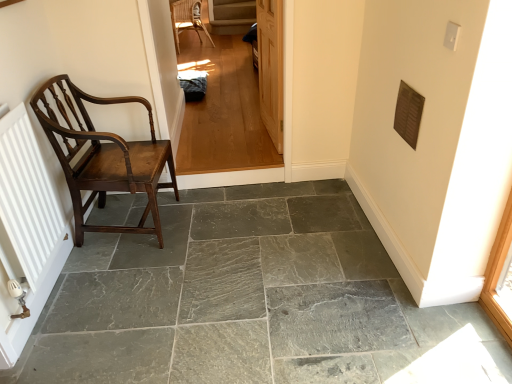
This screenshot has width=512, height=384. Describe the element at coordinates (187, 20) in the screenshot. I see `woven wicker chair at upper center, which is the 2th chair from front to back` at that location.

Locate an element on the screen. gray stone floor at center is located at coordinates (228, 295).

What is the approximate width of light brown wood floor at center?

4.91 inches.

I want to click on woven wicker chair at upper center, which is the 2th chair from front to back, so (x=187, y=20).

From a real-world perspective, who is located higher, gray stone floor at center or light brown wood floor at center?

light brown wood floor at center.

Is gray stone floor at center taller or shorter than light brown wood floor at center?

In the image, gray stone floor at center appears to be shorter than light brown wood floor at center.

Considering the relative positions of gray stone floor at center and light brown wood floor at center in the image provided, is gray stone floor at center to the left of light brown wood floor at center from the viewer's perspective?

In fact, gray stone floor at center is to the right of light brown wood floor at center.

In the scene shown: From the image's perspective, does gray stone floor at center appear higher than light brown wood floor at center?

No, from the image's perspective, gray stone floor at center is not above light brown wood floor at center.

From a real-world perspective, which is physically below, light brown wood floor at center or gray stone floor at center?

gray stone floor at center, from a real-world perspective.

This screenshot has height=384, width=512. I want to click on concrete below the light brown wood floor at center (from a real-world perspective), so pyautogui.click(x=228, y=295).

Which is less distant, [221,40] or [125,351]?

Point [221,40] is positioned farther from the camera compared to point [125,351].

Considering the positions of objects light brown wood floor at center and gray stone floor at center in the image provided, who is in front, light brown wood floor at center or gray stone floor at center?

gray stone floor at center is in front.

Between woven wicker chair at upper center, which ranks as the 2th chair in bottom-to-top order, and polished wood chair at left, the first chair when ordered from front to back, which one has larger width?

woven wicker chair at upper center, which ranks as the 2th chair in bottom-to-top order.

Does woven wicker chair at upper center, which appears as the 1th chair when viewed from the back, appear on the right side of polished wood chair at left, marked as the 1th chair in a bottom-to-top arrangement?

No, woven wicker chair at upper center, which appears as the 1th chair when viewed from the back, is not to the right of polished wood chair at left, marked as the 1th chair in a bottom-to-top arrangement.

Is woven wicker chair at upper center, which is the 2th chair from front to back, inside the boundaries of polished wood chair at left, marked as the second chair in a top-to-bottom arrangement, or outside?

woven wicker chair at upper center, which is the 2th chair from front to back, is spatially situated outside polished wood chair at left, marked as the second chair in a top-to-bottom arrangement.

Consider the image. Could you tell me if gray stone floor at center is facing woven wicker chair at upper center, which appears as the 1th chair when viewed from the back?

No, gray stone floor at center is not turned towards woven wicker chair at upper center, which appears as the 1th chair when viewed from the back.

Is gray stone floor at center positioned far away from woven wicker chair at upper center, which ranks as the 2th chair in bottom-to-top order?

Yes, gray stone floor at center and woven wicker chair at upper center, which ranks as the 2th chair in bottom-to-top order, are located far from each other.

Which object is positioned more to the right, woven wicker chair at upper center, which ranks as the 2th chair in bottom-to-top order, or wooden door at center?

From the viewer's perspective, wooden door at center appears more on the right side.

Is woven wicker chair at upper center, placed as the 1th chair when sorted from top to bottom, positioned with its back to wooden door at center?

woven wicker chair at upper center, placed as the 1th chair when sorted from top to bottom, is not turned away from wooden door at center.

You are a GUI agent. You are given a task and a screenshot of the screen. Output one action in this format:
    pyautogui.click(x=<x>, y=<y>)
    Task: Click on the chair behind the wooden door at center
    
    Given the screenshot: What is the action you would take?
    click(x=187, y=20)

Relative to wooden door at center, is woven wicker chair at upper center, which ranks as the 2th chair in bottom-to-top order, in front or behind?

In the image, woven wicker chair at upper center, which ranks as the 2th chair in bottom-to-top order, appears behind wooden door at center.

Is light brown wood floor at center in front of wooden door at center?

Yes.

Considering the sizes of objects light brown wood floor at center and wooden door at center in the image provided, who is shorter, light brown wood floor at center or wooden door at center?

Standing shorter between the two is wooden door at center.

Where is `door behind the light brown wood floor at center`? The height and width of the screenshot is (384, 512). door behind the light brown wood floor at center is located at coordinates (271, 67).

Looking at the image, does light brown wood floor at center seem bigger or smaller compared to wooden door at center?

Clearly, light brown wood floor at center is larger in size than wooden door at center.

At what (x,y) coordinates should I click in order to perform the action: click on chair below the wooden door at center (from the image's perspective). Please return your answer as a coordinate pair (x, y). The height and width of the screenshot is (384, 512). Looking at the image, I should click on (103, 156).

Does wooden door at center have a lesser width compared to polished wood chair at left, marked as the 1th chair in a bottom-to-top arrangement?

Yes, wooden door at center is thinner than polished wood chair at left, marked as the 1th chair in a bottom-to-top arrangement.

From a real-world perspective, between wooden door at center and polished wood chair at left, the first chair when ordered from front to back, who is vertically lower?

From a 3D spatial view, polished wood chair at left, the first chair when ordered from front to back, is below.

Measure the distance from wooden door at center to polished wood chair at left, acting as the 2th chair starting from the back.

The distance of wooden door at center from polished wood chair at left, acting as the 2th chair starting from the back, is 3.59 feet.

This screenshot has height=384, width=512. I want to click on concrete on the right of light brown wood floor at center, so tap(228, 295).

Identify the location of corridor lying above the gray stone floor at center (from the image's perspective). The image size is (512, 384). (223, 110).

Estimate the real-world distances between objects in this image. Which object is closer to polished wood chair at left, marked as the second chair in a top-to-bottom arrangement, gray stone floor at center or woven wicker chair at upper center, which ranks as the 2th chair in bottom-to-top order?

gray stone floor at center lies closer to polished wood chair at left, marked as the second chair in a top-to-bottom arrangement, than the other object.

Based on their spatial positions, is woven wicker chair at upper center, which is the 2th chair from front to back, or light brown wood floor at center further from wooden door at center?

woven wicker chair at upper center, which is the 2th chair from front to back, is positioned further to the anchor wooden door at center.

Which object lies nearer to the anchor point wooden door at center, woven wicker chair at upper center, placed as the 1th chair when sorted from top to bottom, or polished wood chair at left, the first chair when ordered from front to back?

polished wood chair at left, the first chair when ordered from front to back.

When comparing their distances from gray stone floor at center, does polished wood chair at left, marked as the 1th chair in a bottom-to-top arrangement, or woven wicker chair at upper center, which is the 2th chair from front to back, seem further?

The object further to gray stone floor at center is woven wicker chair at upper center, which is the 2th chair from front to back.

Looking at the image, which one is located further to gray stone floor at center, wooden door at center or polished wood chair at left, acting as the 2th chair starting from the back?

The object further to gray stone floor at center is wooden door at center.

From the image, which object appears to be nearer to polished wood chair at left, acting as the 2th chair starting from the back, wooden door at center or light brown wood floor at center?

light brown wood floor at center is positioned closer to the anchor polished wood chair at left, acting as the 2th chair starting from the back.

Based on their spatial positions, is wooden door at center or woven wicker chair at upper center, which appears as the 1th chair when viewed from the back, further from polished wood chair at left, acting as the 2th chair starting from the back?

Based on the image, woven wicker chair at upper center, which appears as the 1th chair when viewed from the back, appears to be further to polished wood chair at left, acting as the 2th chair starting from the back.

Based on their spatial positions, is gray stone floor at center or wooden door at center closer to light brown wood floor at center?

Based on the image, wooden door at center appears to be nearer to light brown wood floor at center.

Identify the location of corridor between polished wood chair at left, marked as the 1th chair in a bottom-to-top arrangement, and wooden door at center from left to right. The image size is (512, 384). (223, 110).

The height and width of the screenshot is (384, 512). I want to click on chair that lies between wooden door at center and gray stone floor at center from top to bottom, so click(x=103, y=156).

At what (x,y) coordinates should I click in order to perform the action: click on corridor between wooden door at center and gray stone floor at center from top to bottom. Please return your answer as a coordinate pair (x, y). The width and height of the screenshot is (512, 384). Looking at the image, I should click on (223, 110).

Find the location of a particular element. The image size is (512, 384). chair positioned between gray stone floor at center and woven wicker chair at upper center, which ranks as the 2th chair in bottom-to-top order, from near to far is located at coordinates (103, 156).